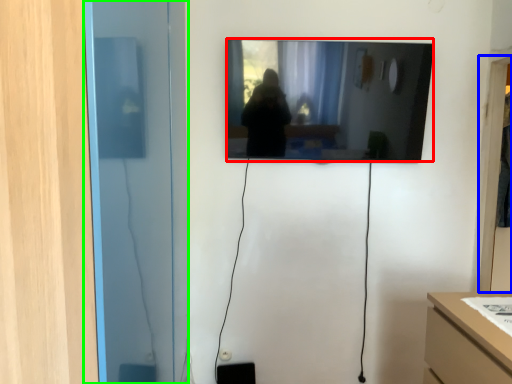
Question: Based on their relative distances, which object is farther from mirror (highlighted by a red box)? Choose from glass door (highlighted by a blue box) and glass door (highlighted by a green box).

Choices:
 (A) glass door
 (B) glass door

Answer: (B)